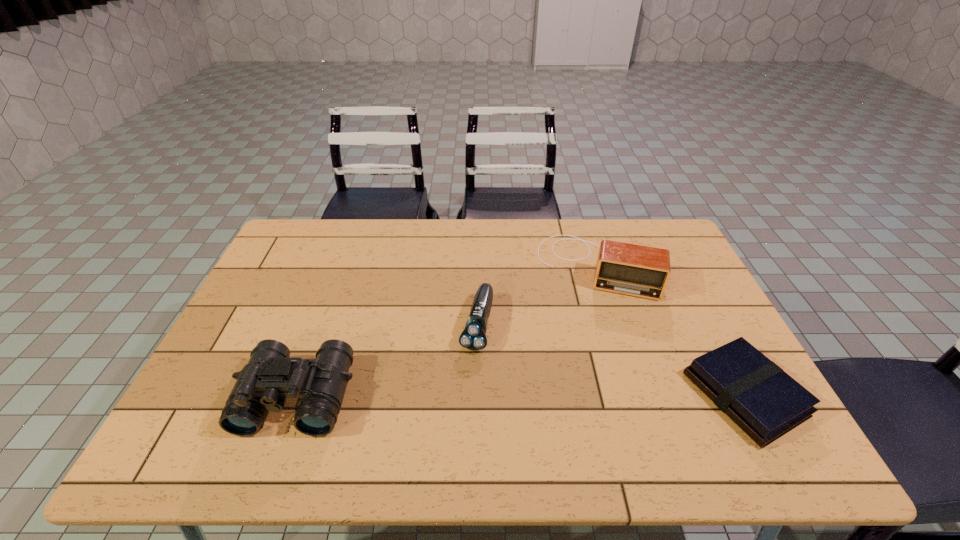
This screenshot has height=540, width=960. Find the location of `vacant area located on the head of the second object from left to right`. vacant area located on the head of the second object from left to right is located at coordinates (468, 374).

Identify the location of free region located on the head of the second object from left to right. (461, 404).

In order to click on vacant space situated 0.190m on the head of the second object from left to right in this screenshot , I will do `click(457, 420)`.

Where is `object that is positioned at the far edge`? object that is positioned at the far edge is located at coordinates (642, 271).

Identify the location of binoculars at the near edge. (270, 376).

In order to click on book at the near edge in this screenshot , I will do `click(756, 394)`.

The image size is (960, 540). I want to click on object that is at the left edge, so click(x=270, y=376).

Where is `book that is at the right edge`? Image resolution: width=960 pixels, height=540 pixels. book that is at the right edge is located at coordinates (756, 394).

This screenshot has width=960, height=540. Identify the location of radio receiver that is at the right edge. (642, 271).

Locate an element on the screen. This screenshot has width=960, height=540. object at the near left corner is located at coordinates (270, 376).